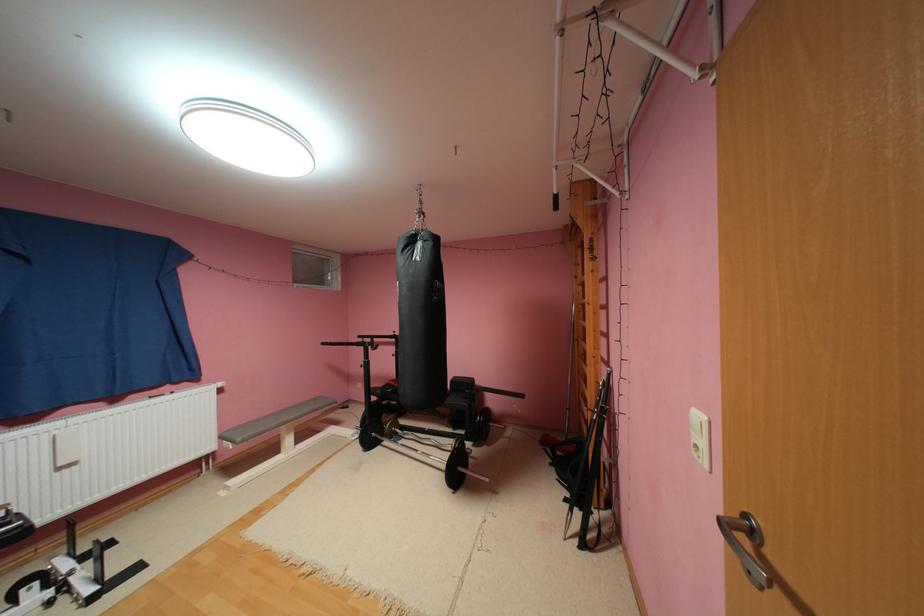
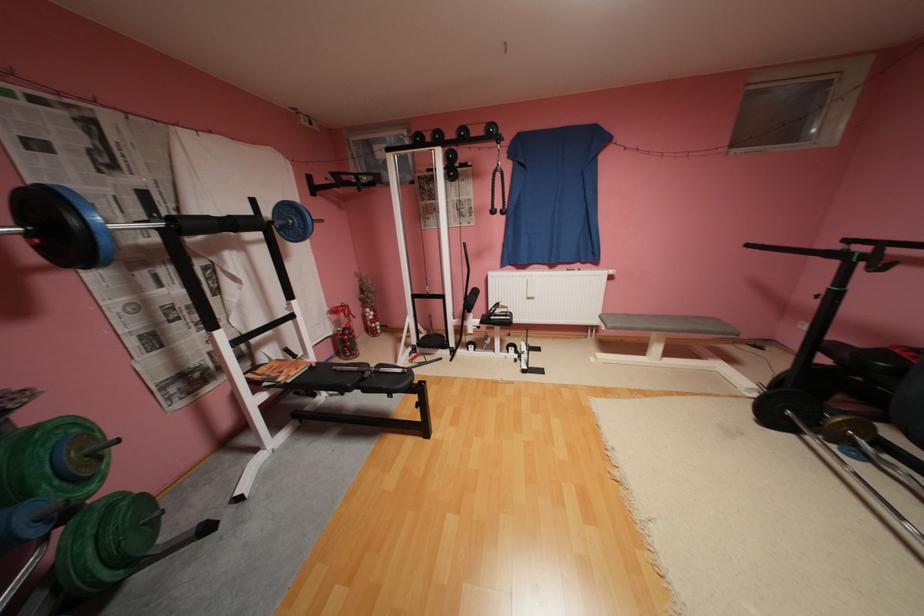
Locate, in the second image, the point that corresponds to (406,432) in the first image.

(867, 445)